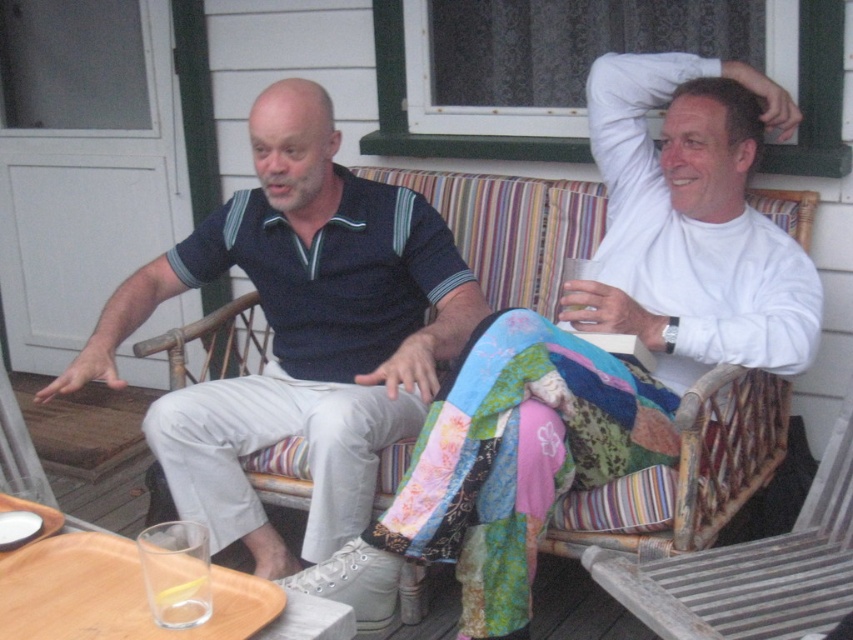
Between dark blue polo shirt at center and wooden slats rocking chair at lower right, which one appears on the left side from the viewer's perspective?

dark blue polo shirt at center

Is point (427, 266) closer to camera compared to point (635, 600)?

No, it is not.

Locate an element on the screen. dark blue polo shirt at center is located at coordinates (300, 332).